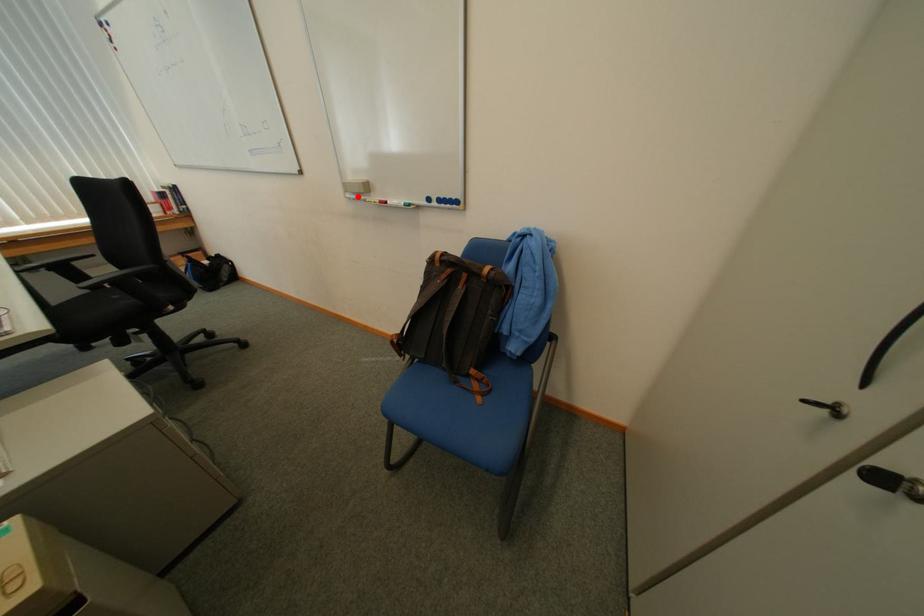
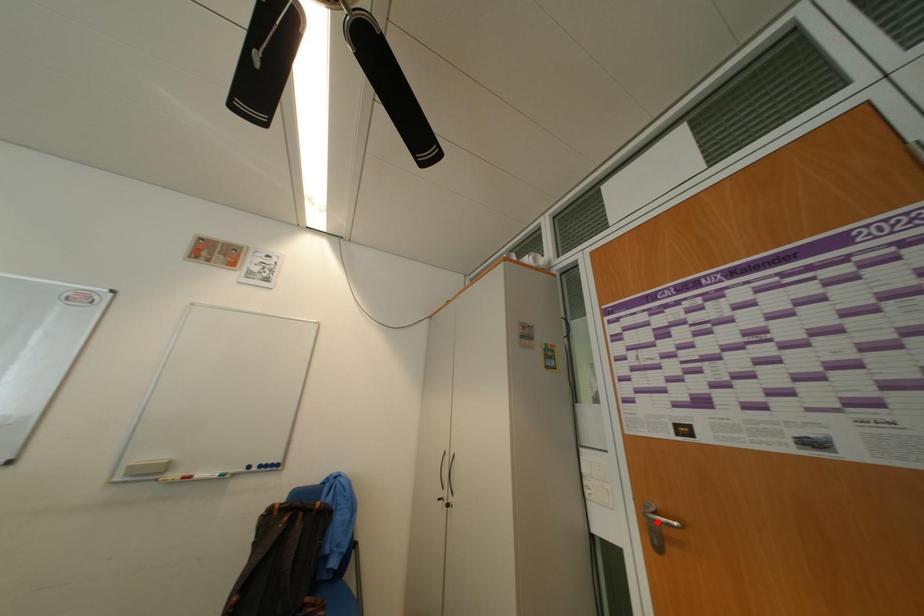
I am providing you with two images of the same scene from different viewpoints. A red point is marked on the first image and another point is marked on the second image. Is the marked point in image1 the same physical position as the marked point in image2?

No